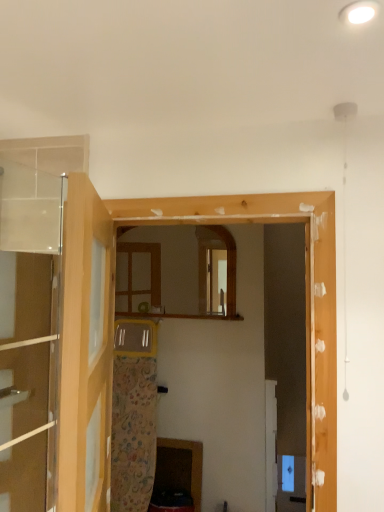
Question: Is wooden frame at center facing away from wooden cabinet at lower center?

Choices:
 (A) no
 (B) yes

Answer: (B)

Question: Is wooden frame at center next to wooden cabinet at lower center?

Choices:
 (A) yes
 (B) no

Answer: (B)

Question: From a real-world perspective, is wooden frame at center positioned under wooden cabinet at lower center based on gravity?

Choices:
 (A) yes
 (B) no

Answer: (B)

Question: From the image's perspective, does wooden frame at center appear lower than wooden cabinet at lower center?

Choices:
 (A) no
 (B) yes

Answer: (A)

Question: From the image's perspective, is wooden frame at center located above wooden cabinet at lower center?

Choices:
 (A) no
 (B) yes

Answer: (B)

Question: Considering their positions, is clear glass door at upper left, placed as the first door when sorted from right to left, located in front of or behind wooden mirror at center?

Choices:
 (A) front
 (B) behind

Answer: (A)

Question: Based on their sizes in the image, would you say clear glass door at upper left, the 2th door viewed from the left, is bigger or smaller than wooden mirror at center?

Choices:
 (A) big
 (B) small

Answer: (A)

Question: From a real-world perspective, is clear glass door at upper left, the 2th door viewed from the left, above or below wooden mirror at center?

Choices:
 (A) above
 (B) below

Answer: (B)

Question: Is clear glass door at upper left, the 2th door viewed from the left, inside the boundaries of wooden mirror at center, or outside?

Choices:
 (A) outside
 (B) inside

Answer: (A)

Question: Is transparent glass door at left, which is the 1th door from left to right, in front of or behind wooden cabinet at lower center in the image?

Choices:
 (A) behind
 (B) front

Answer: (B)

Question: From a real-world perspective, relative to wooden cabinet at lower center, is transparent glass door at left, the second door from the right, vertically above or below?

Choices:
 (A) above
 (B) below

Answer: (A)

Question: Based on their positions, is transparent glass door at left, the second door from the right, located to the left or right of wooden cabinet at lower center?

Choices:
 (A) left
 (B) right

Answer: (A)

Question: In terms of size, does transparent glass door at left, which is the 1th door from left to right, appear bigger or smaller than wooden cabinet at lower center?

Choices:
 (A) small
 (B) big

Answer: (A)

Question: Considering their positions, is clear glass door at upper left, placed as the first door when sorted from right to left, located in front of or behind wooden cabinet at lower center?

Choices:
 (A) front
 (B) behind

Answer: (A)

Question: From a real-world perspective, is clear glass door at upper left, placed as the first door when sorted from right to left, positioned above or below wooden cabinet at lower center?

Choices:
 (A) above
 (B) below

Answer: (A)